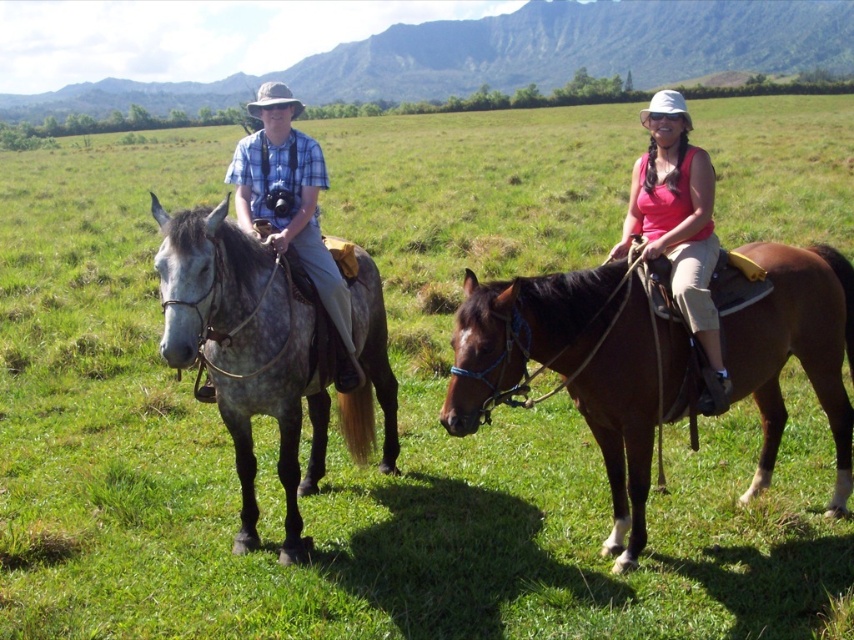
Who is lower down, matte pink tank top at center or matte blue plaid shirt at left?

Positioned lower is matte blue plaid shirt at left.

The image size is (854, 640). I want to click on matte pink tank top at center, so click(679, 228).

Does point (662, 179) come in front of point (341, 346)?

Yes, it is in front of point (341, 346).

I want to click on matte pink tank top at center, so click(x=679, y=228).

Is gray speckled horse at left taller than matte pink tank top at center?

In fact, gray speckled horse at left may be shorter than matte pink tank top at center.

How distant is gray speckled horse at left from matte pink tank top at center?

gray speckled horse at left and matte pink tank top at center are 6.49 feet apart.

Which is behind, point (234, 429) or point (673, 125)?

The point (234, 429) is behind.

You are a GUI agent. You are given a task and a screenshot of the screen. Output one action in this format:
    pyautogui.click(x=<x>, y=<y>)
    Task: Click on the gray speckled horse at left
    
    Given the screenshot: What is the action you would take?
    pyautogui.click(x=244, y=349)

Who is higher up, brown glossy horse at center or gray speckled horse at left?

gray speckled horse at left is higher up.

Does brown glossy horse at center have a lesser height compared to gray speckled horse at left?

Indeed, brown glossy horse at center has a lesser height compared to gray speckled horse at left.

The width and height of the screenshot is (854, 640). Identify the location of brown glossy horse at center. (578, 371).